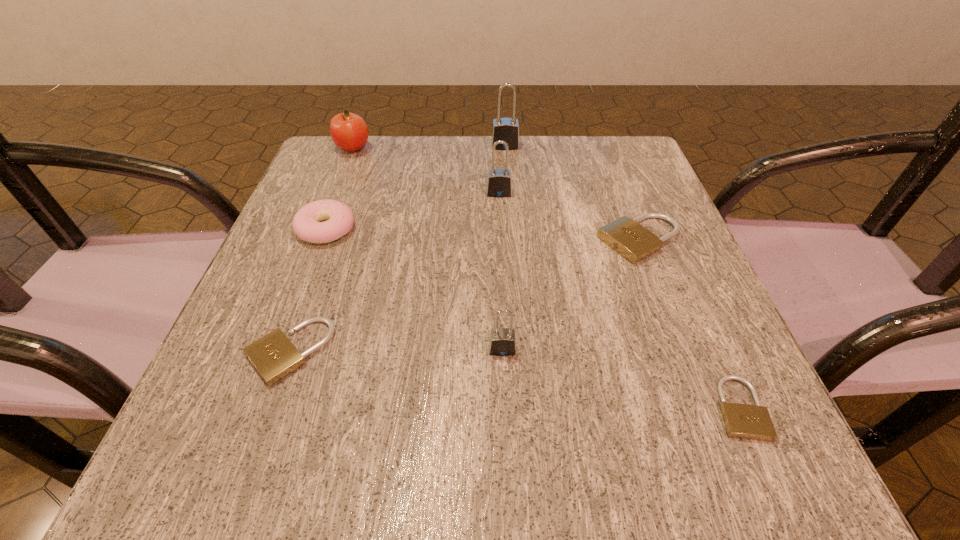
Find the location of a particular element. The height and width of the screenshot is (540, 960). the sixth tallest object is located at coordinates (626, 236).

Find the location of a particular element. Image resolution: width=960 pixels, height=540 pixels. the leftmost padlock is located at coordinates (274, 356).

At what (x,y) coordinates should I click in order to perform the action: click on the second biggest beige padlock. Please return your answer as a coordinate pair (x, y). The width and height of the screenshot is (960, 540). Looking at the image, I should click on (274, 356).

You are a GUI agent. You are given a task and a screenshot of the screen. Output one action in this format:
    pyautogui.click(x=<x>, y=<y>)
    Task: Click on the smallest beige padlock
    The image size is (960, 540).
    Given the screenshot: What is the action you would take?
    pyautogui.click(x=744, y=421)

Identify the location of the shortest object. The height and width of the screenshot is (540, 960). (744, 421).

Find the location of `free space located on the shackle of the tallest padlock`. free space located on the shackle of the tallest padlock is located at coordinates coord(511,217).

Identify the location of vacant area situated on the shackle of the second nearest gray padlock. The image size is (960, 540). (500, 226).

Identify the location of vacant position located on the front of the apple. The image size is (960, 540). (326, 218).

This screenshot has height=540, width=960. I want to click on free location located 0.140m on the shackle of the smallest gray padlock, so click(507, 453).

The image size is (960, 540). In order to click on free space located on the back of the fourth shortest object in this screenshot , I will do [x=361, y=136].